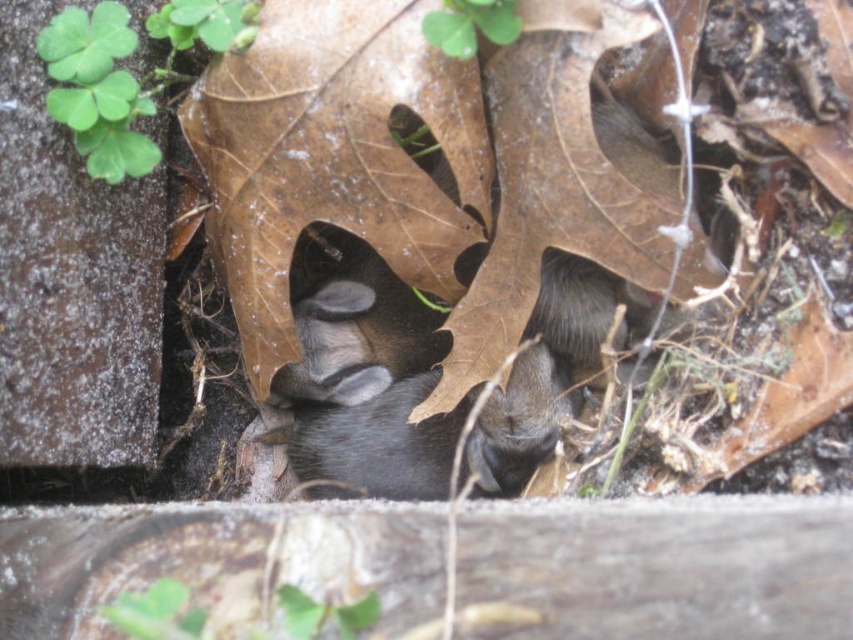
Can you confirm if black fur at center is taller than black matte fur at center?

In fact, black fur at center may be shorter than black matte fur at center.

The width and height of the screenshot is (853, 640). What are the coordinates of `black fur at center` in the screenshot? It's located at (373, 435).

Identify the location of black fur at center. (373, 435).